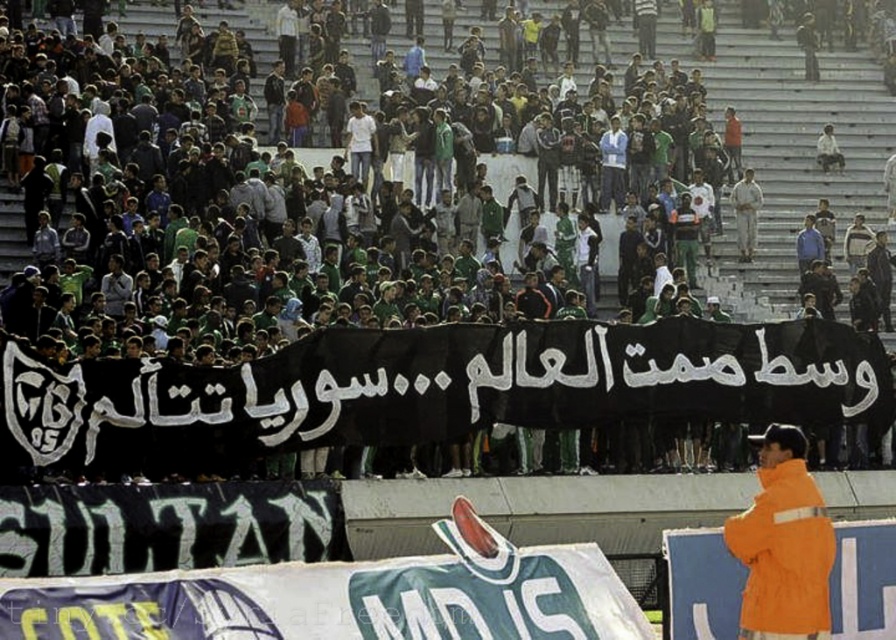
You are a photographer standing at the edge of the crowd. You want to capture a photo of the black fabric banner at center and the orange matte jacket at lower right in the same frame. Based on their positions, which object is closer to you?

The orange matte jacket at lower right is closer to you because it is positioned at the lower right, which is typically nearer in such scenes compared to the central banner that might be further back.

You are a photographer standing at the edge of the crowd. You want to capture both the black fabric banner at center and the orange matte jacket at lower right in a single photo. Can you see both objects in your current position?

The black fabric banner at center is positioned over orange matte jacket at lower right, so the photographer cannot see the orange matte jacket at lower right because it is blocked by the banner.